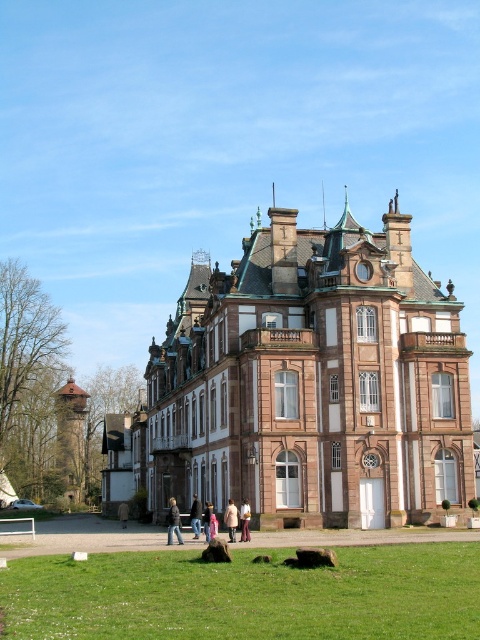
Question: Does light brown leather jacket at center come behind light brown fabric pants at center?

Choices:
 (A) yes
 (B) no

Answer: (A)

Question: Is pink stone palace at center thinner than green grass at lower center?

Choices:
 (A) no
 (B) yes

Answer: (A)

Question: Which object is farther from the camera taking this photo?

Choices:
 (A) pink stone palace at center
 (B) dark blue leather jacket at center
 (C) green grass at lower center
 (D) pink fabric coat at center

Answer: (A)

Question: Is green grass at lower center further to the viewer compared to light brown fabric pants at center?

Choices:
 (A) yes
 (B) no

Answer: (B)

Question: Which point appears closest to the camera in this image?

Choices:
 (A) (55, 556)
 (B) (172, 509)
 (C) (228, 508)
 (D) (247, 512)

Answer: (A)

Question: Which object is closer to the camera taking this photo?

Choices:
 (A) green grass at lower center
 (B) pink fabric coat at center

Answer: (A)